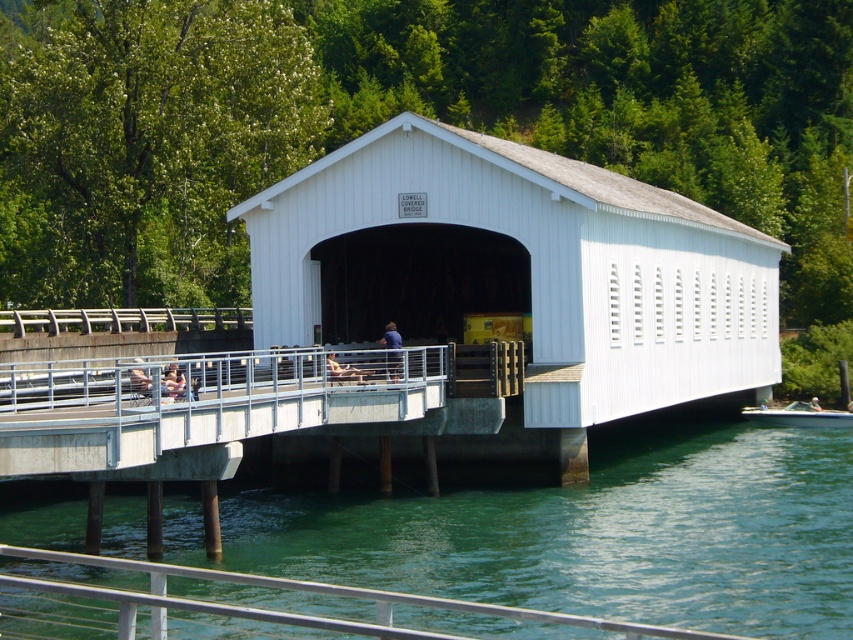
Does blue fabric shirt at center have a lesser height compared to matte pink shirt at center?

Incorrect, blue fabric shirt at center's height does not fall short of matte pink shirt at center's.

Between blue fabric shirt at center and matte pink shirt at center, which one appears on the right side from the viewer's perspective?

From the viewer's perspective, blue fabric shirt at center appears more on the right side.

Where is `blue fabric shirt at center`? The width and height of the screenshot is (853, 640). blue fabric shirt at center is located at coordinates (390, 337).

Describe the element at coordinates (589, 534) in the screenshot. I see `green translucent water at lower center` at that location.

I want to click on green translucent water at lower center, so click(589, 534).

Locate an element on the screen. green translucent water at lower center is located at coordinates (589, 534).

Looking at this image, between white plastic boat at lower right and green fabric kayak at center, which one has more height?

white plastic boat at lower right is taller.

Is point (817, 416) more distant than point (811, 401)?

No, (817, 416) is in front of (811, 401).

Between point (792, 412) and point (811, 408), which one is positioned in front?

Positioned in front is point (792, 412).

Locate an element on the screen. white plastic boat at lower right is located at coordinates (799, 416).